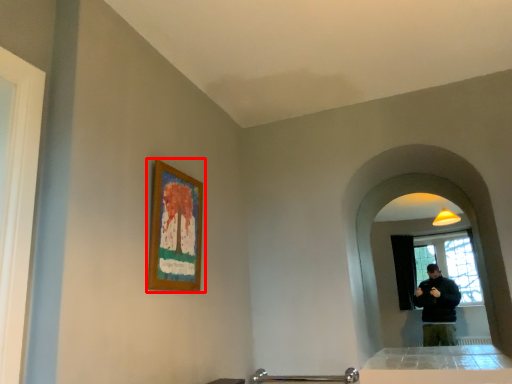
Question: From the image's perspective, considering the relative positions of picture frame (annotated by the red box) and mirror in the image provided, where is picture frame (annotated by the red box) located with respect to the staircase?

Choices:
 (A) above
 (B) below

Answer: (A)